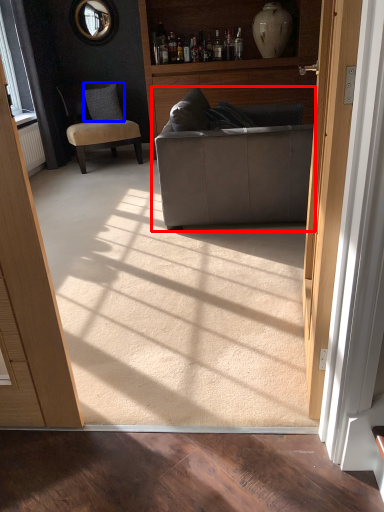
Question: Which object is closer to the camera taking this photo, studio couch (highlighted by a red box) or pillow (highlighted by a blue box)?

Choices:
 (A) studio couch
 (B) pillow

Answer: (A)